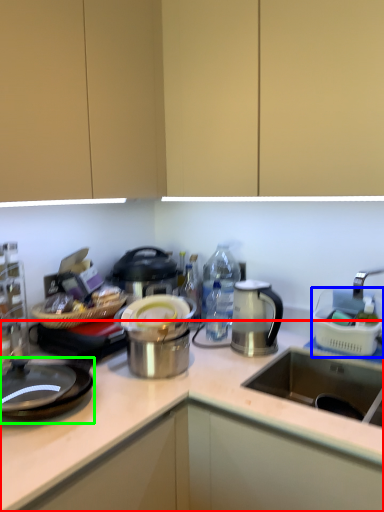
Question: Which object is the farthest from countertop (highlighted by a red box)? Choose among these: appliance (highlighted by a blue box) or gas stove (highlighted by a green box).

Choices:
 (A) appliance
 (B) gas stove

Answer: (A)